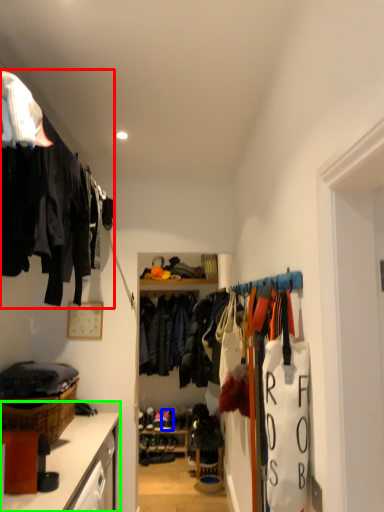
Question: Considering the real-world distances, which object is farthest from closet (highlighted by a red box)? footwear (highlighted by a blue box) or cabinetry (highlighted by a green box)?

Choices:
 (A) footwear
 (B) cabinetry

Answer: (A)